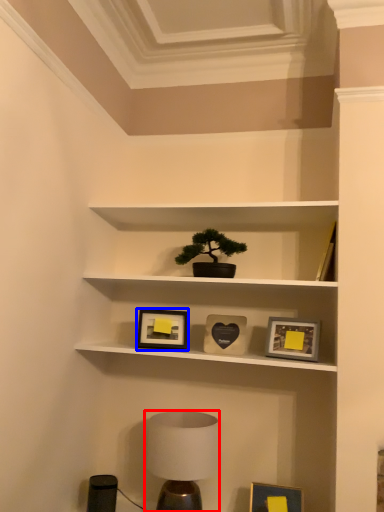
Question: Among these objects, which one is farthest to the camera, table lamp (highlighted by a red box) or picture frame (highlighted by a blue box)?

Choices:
 (A) table lamp
 (B) picture frame

Answer: (B)